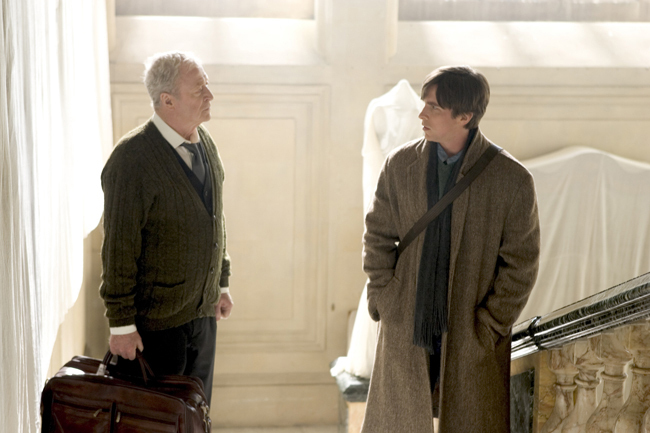
At what (x,y) coordinates should I click in order to perform the action: click on wall marble shining from lights. Please return your answer as a coordinate pair (x, y). The image size is (650, 433). Looking at the image, I should click on (212, 40), (545, 40).